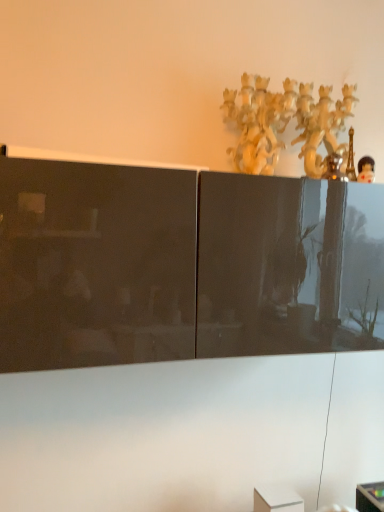
Question: Does polished plastic figurine at upper right have a smaller size compared to matte black cabinet at upper center?

Choices:
 (A) no
 (B) yes

Answer: (B)

Question: From the image's perspective, is polished plastic figurine at upper right over matte black cabinet at upper center?

Choices:
 (A) no
 (B) yes

Answer: (B)

Question: Is polished plastic figurine at upper right bigger than matte black cabinet at upper center?

Choices:
 (A) yes
 (B) no

Answer: (B)

Question: Does polished plastic figurine at upper right appear on the left side of matte black cabinet at upper center?

Choices:
 (A) no
 (B) yes

Answer: (B)

Question: Is polished plastic figurine at upper right shorter than matte black cabinet at upper center?

Choices:
 (A) yes
 (B) no

Answer: (A)

Question: Considering the positions of matte black cabinet at upper center and polished plastic figurine at upper right in the image, is matte black cabinet at upper center wider or thinner than polished plastic figurine at upper right?

Choices:
 (A) wide
 (B) thin

Answer: (A)

Question: In terms of size, does matte black cabinet at upper center appear bigger or smaller than polished plastic figurine at upper right?

Choices:
 (A) small
 (B) big

Answer: (B)

Question: Is point (360, 501) positioned closer to the camera than point (367, 180)?

Choices:
 (A) closer
 (B) farther

Answer: (B)

Question: In the image, is matte black cabinet at upper center on the left side or the right side of polished plastic figurine at upper right?

Choices:
 (A) left
 (B) right

Answer: (B)

Question: From the image's perspective, relative to white glossy cabinet at upper center, is polished plastic figurine at upper right above or below?

Choices:
 (A) below
 (B) above

Answer: (B)

Question: From a real-world perspective, is polished plastic figurine at upper right above or below white glossy cabinet at upper center?

Choices:
 (A) below
 (B) above

Answer: (B)

Question: Considering the positions of polished plastic figurine at upper right and white glossy cabinet at upper center in the image, is polished plastic figurine at upper right wider or thinner than white glossy cabinet at upper center?

Choices:
 (A) thin
 (B) wide

Answer: (A)

Question: Considering their positions, is polished plastic figurine at upper right located in front of or behind white glossy cabinet at upper center?

Choices:
 (A) front
 (B) behind

Answer: (A)

Question: Is matte black cabinet at upper center wider or thinner than white glossy cabinet at upper center?

Choices:
 (A) thin
 (B) wide

Answer: (B)

Question: From a real-world perspective, relative to white glossy cabinet at upper center, is matte black cabinet at upper center vertically above or below?

Choices:
 (A) above
 (B) below

Answer: (B)